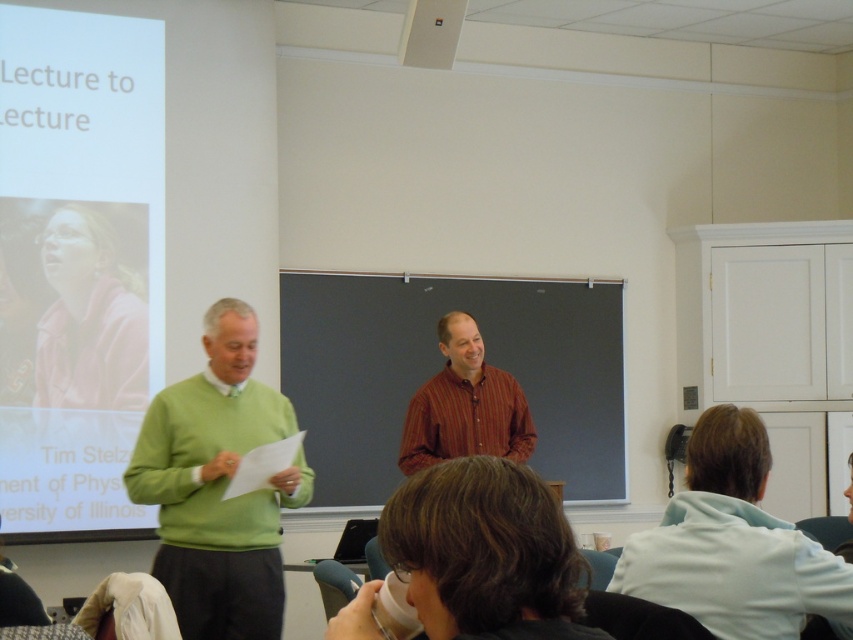
You are an interior designer assessing the classroom layout. The green sweater at left and striped cotton shirt at center are part of the presentation setup. If you need to place a 1.2 meter wide desk between them, will there be enough space?

The green sweater at left has a lesser width compared to striped cotton shirt at center. Since the desk is 1.2 meters wide, and the space between them is determined by their widths, the desk may not fit if the combined width of both objects exceeds the available space. However, without exact measurements of the room, it is difficult to confirm.

You are an attendee at the presentation. You want to hand a note to the presenter wearing the striped cotton shirt at center without disturbing the person in green sweater at left. Which direction should you approach from?

The green sweater at left is positioned under striped cotton shirt at center, so you should approach from the right side to avoid disturbing the person in green sweater at left.

Looking at this image, where is the green sweater at left located in the image?

The green sweater at left is located at point coordinates of (218, 486).